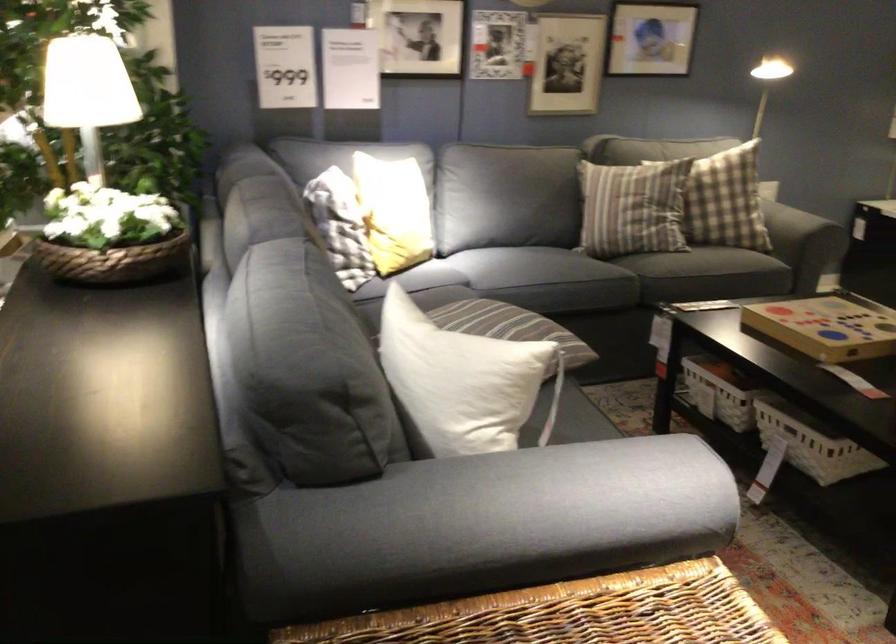
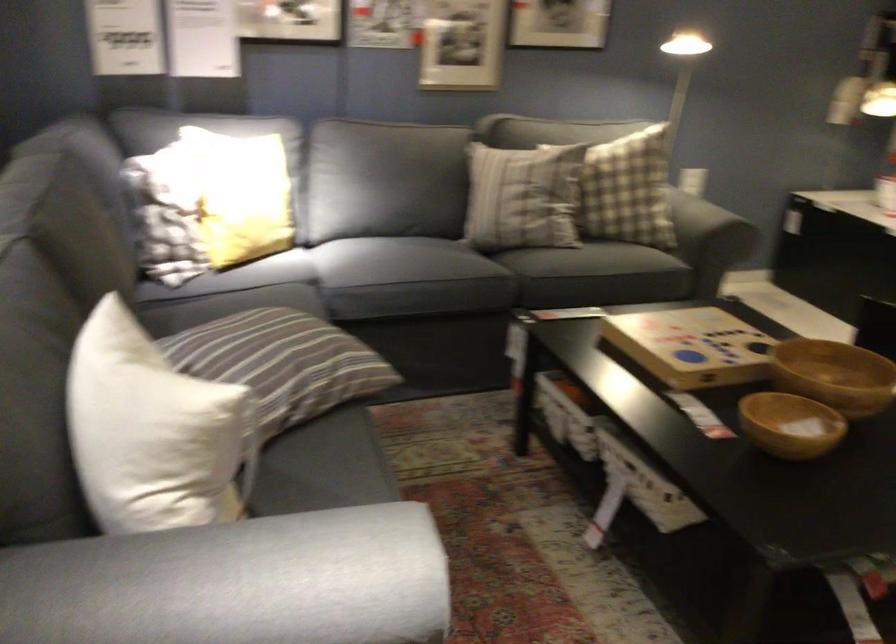
Question: Based on the continuous images, in which direction is the camera rotating? Reply with the corresponding letter.

Choices:
 (A) Left
 (B) Right
 (C) Up
 (D) Down

Answer: (B)